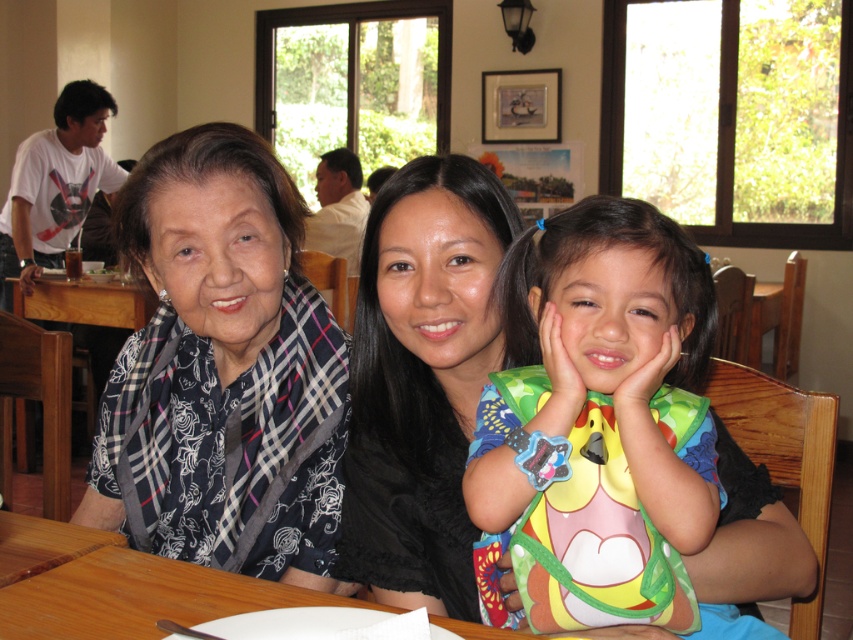
Question: Can you confirm if plaid fabric shawl at left is positioned above multicolored fabric bib at center?

Choices:
 (A) no
 (B) yes

Answer: (B)

Question: Is plaid fabric shawl at left bigger than matte black blouse at center?

Choices:
 (A) no
 (B) yes

Answer: (B)

Question: Estimate the real-world distances between objects in this image. Which object is farther from the wooden table at center?

Choices:
 (A) matte black blouse at center
 (B) multicolored fabric bib at center

Answer: (B)

Question: Considering the real-world distances, which object is farthest from the multicolored fabric bib at center?

Choices:
 (A) matte black blouse at center
 (B) plaid fabric shawl at left
 (C) wooden table at center

Answer: (B)

Question: Is multicolored fabric bib at center to the left of wooden table at center from the viewer's perspective?

Choices:
 (A) yes
 (B) no

Answer: (B)

Question: Which point is farther to the camera?

Choices:
 (A) (302, 552)
 (B) (6, 595)

Answer: (A)